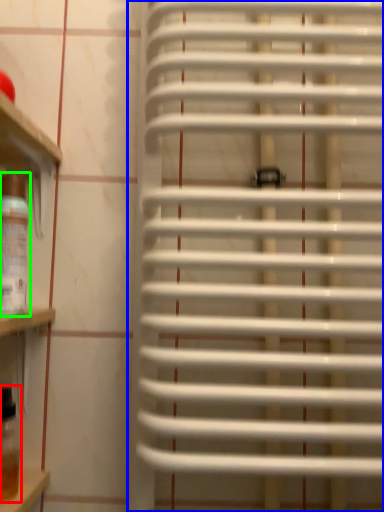
Question: Considering the real-world distances, which object is closest to wine bottle (highlighted by a red box)? window blind (highlighted by a blue box) or wine bottle (highlighted by a green box).

Choices:
 (A) window blind
 (B) wine bottle

Answer: (B)